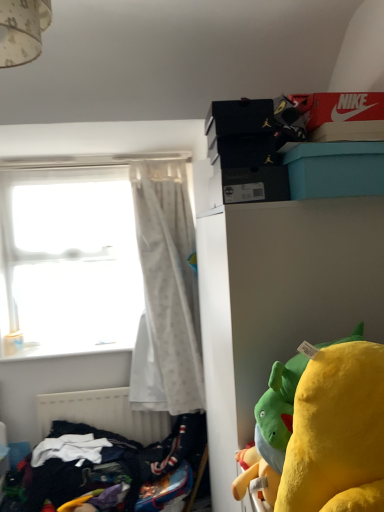
Question: Would you say transparent glass window at left is inside or outside white sheer curtain at left?

Choices:
 (A) outside
 (B) inside

Answer: (A)

Question: In terms of height, does transparent glass window at left look taller or shorter compared to white sheer curtain at left?

Choices:
 (A) short
 (B) tall

Answer: (A)

Question: Which of these objects is positioned farthest from the white matte radiator at lower left?

Choices:
 (A) white matte cabinet at upper right
 (B) white sheer curtain at left
 (C) teal plastic box at upper right
 (D) transparent glass window at left
 (E) dark blue fabric at lower left

Answer: (C)

Question: Which object is the farthest from the teal plastic box at upper right?

Choices:
 (A) white matte radiator at lower left
 (B) dark blue fabric at lower left
 (C) transparent glass window at left
 (D) white matte cabinet at upper right
 (E) white sheer curtain at left

Answer: (A)